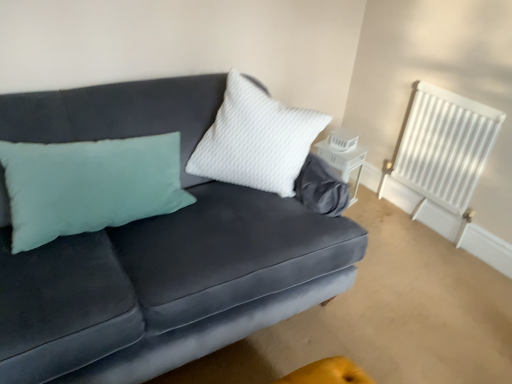
Question: Is white painted metal radiator at upper right in contact with velvet dark blue couch at center?

Choices:
 (A) yes
 (B) no

Answer: (B)

Question: Can velvet dark blue couch at center be found inside white painted metal radiator at upper right?

Choices:
 (A) yes
 (B) no

Answer: (B)

Question: From the image's perspective, would you say white painted metal radiator at upper right is shown under velvet dark blue couch at center?

Choices:
 (A) no
 (B) yes

Answer: (A)

Question: From a real-world perspective, does white painted metal radiator at upper right sit lower than velvet dark blue couch at center?

Choices:
 (A) no
 (B) yes

Answer: (B)

Question: Is white painted metal radiator at upper right closer to the viewer compared to velvet dark blue couch at center?

Choices:
 (A) yes
 (B) no

Answer: (B)

Question: Is point (16, 372) positioned closer to the camera than point (407, 125)?

Choices:
 (A) closer
 (B) farther

Answer: (A)

Question: From a real-world perspective, is velvet dark blue couch at center above or below white painted metal radiator at upper right?

Choices:
 (A) below
 (B) above

Answer: (B)

Question: From their relative heights in the image, would you say velvet dark blue couch at center is taller or shorter than white painted metal radiator at upper right?

Choices:
 (A) short
 (B) tall

Answer: (B)

Question: In terms of size, does velvet dark blue couch at center appear bigger or smaller than white painted metal radiator at upper right?

Choices:
 (A) small
 (B) big

Answer: (B)

Question: From the image's perspective, is white matte lantern at center located above or below white painted metal radiator at upper right?

Choices:
 (A) below
 (B) above

Answer: (A)

Question: Relative to white painted metal radiator at upper right, is white matte lantern at center in front or behind?

Choices:
 (A) front
 (B) behind

Answer: (B)

Question: Is white matte lantern at center inside or outside of white painted metal radiator at upper right?

Choices:
 (A) outside
 (B) inside

Answer: (A)

Question: Considering the positions of white matte lantern at center and white painted metal radiator at upper right in the image, is white matte lantern at center bigger or smaller than white painted metal radiator at upper right?

Choices:
 (A) small
 (B) big

Answer: (A)

Question: From the image's perspective, is white matte lantern at center positioned above or below velvet dark blue couch at center?

Choices:
 (A) below
 (B) above

Answer: (B)

Question: Considering the positions of point (350, 153) and point (148, 228), is point (350, 153) closer or farther from the camera than point (148, 228)?

Choices:
 (A) closer
 (B) farther

Answer: (B)